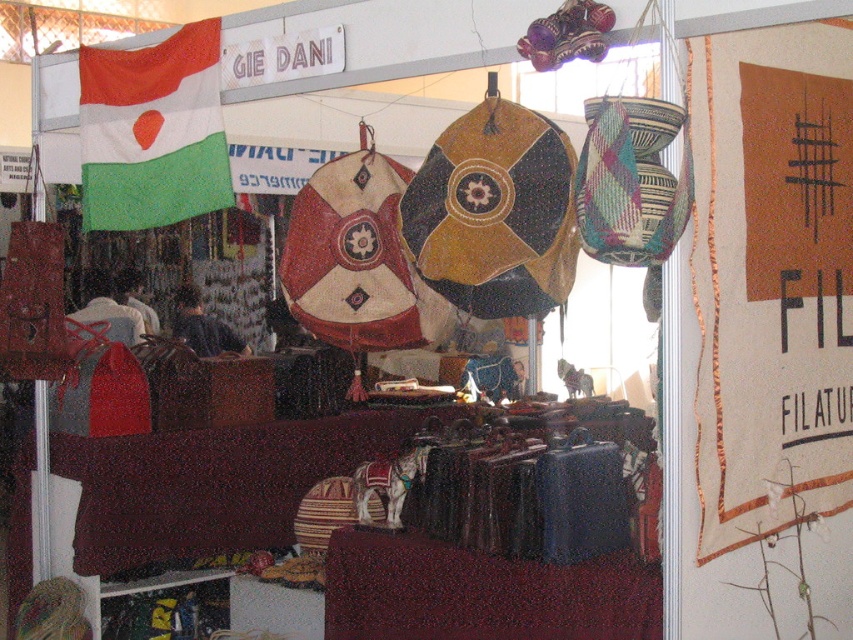
Question: In this image, where is brown fabric at upper right located relative to green fabric flag at upper left?

Choices:
 (A) left
 (B) right

Answer: (B)

Question: In this image, where is brown fabric at upper right located relative to green fabric flag at upper left?

Choices:
 (A) below
 (B) above

Answer: (A)

Question: Which object appears farthest from the camera in this image?

Choices:
 (A) green fabric flag at upper left
 (B) brown fabric at upper right

Answer: (A)

Question: Is brown fabric at upper right thinner than green fabric flag at upper left?

Choices:
 (A) no
 (B) yes

Answer: (B)

Question: Which point is closer to the camera taking this photo?

Choices:
 (A) (215, 84)
 (B) (749, 465)

Answer: (B)